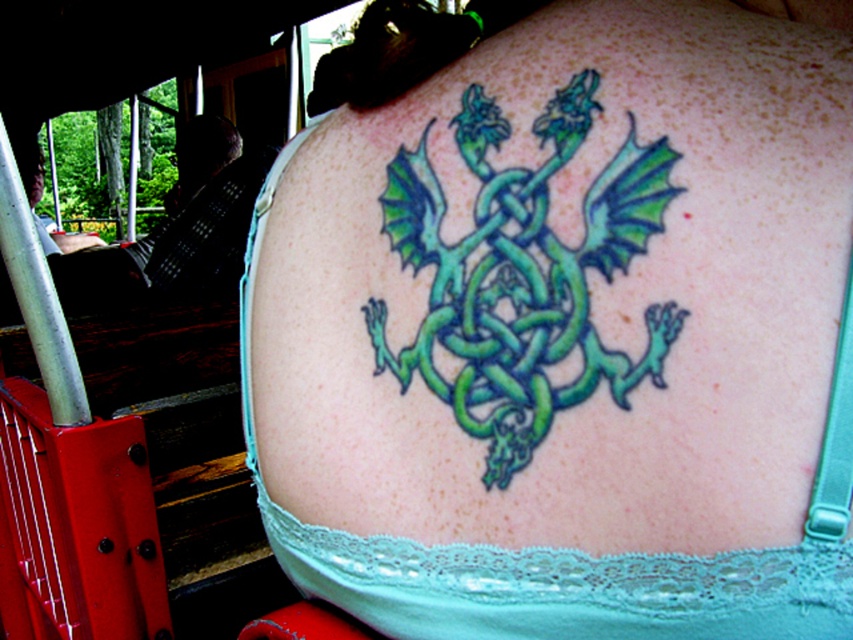
Which is more to the left, green tattooed dragon at center or green glossy dragon at center?

green tattooed dragon at center

Does point (529, 564) lie in front of point (498, 289)?

No, it is behind (498, 289).

At what (x,y) coordinates should I click in order to perform the action: click on green tattooed dragon at center. Please return your answer as a coordinate pair (x, y). Looking at the image, I should click on (561, 326).